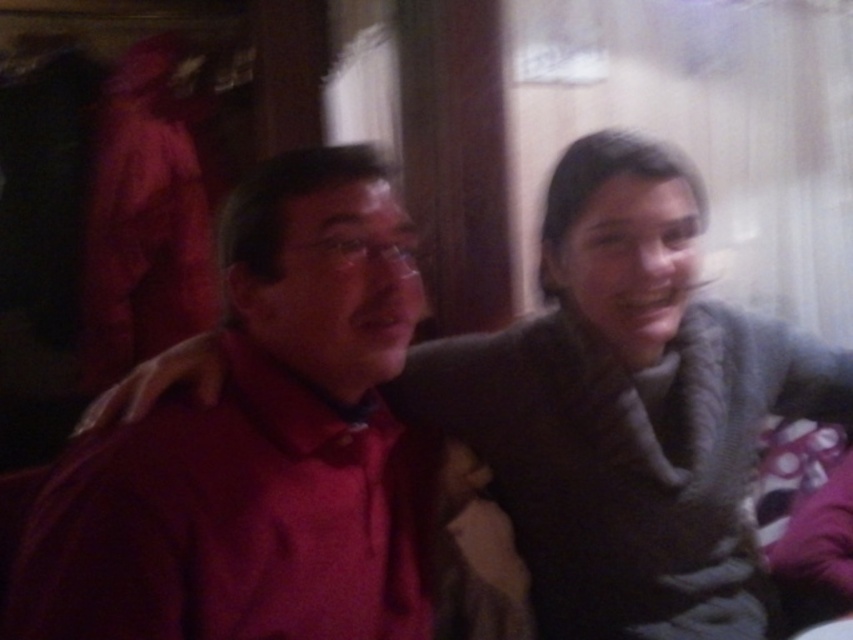
Question: Which of the following is the closest to the observer?

Choices:
 (A) matte red shirt at left
 (B) dark gray sweater at center

Answer: (A)

Question: Among these objects, which one is farthest from the camera?

Choices:
 (A) dark gray sweater at center
 (B) matte red shirt at left

Answer: (A)

Question: Observing the image, what is the correct spatial positioning of matte red shirt at left in reference to dark gray sweater at center?

Choices:
 (A) right
 (B) left

Answer: (B)

Question: Can you confirm if matte red shirt at left is positioned to the left of dark gray sweater at center?

Choices:
 (A) yes
 (B) no

Answer: (A)

Question: Is matte red shirt at left wider than dark gray sweater at center?

Choices:
 (A) no
 (B) yes

Answer: (A)